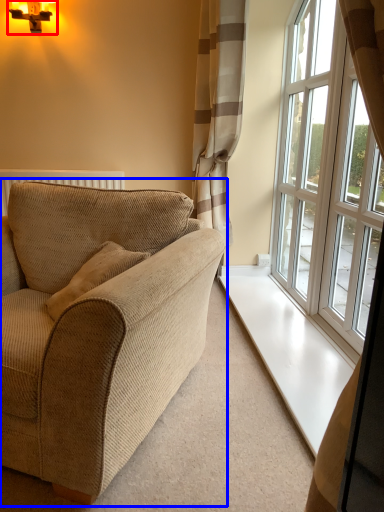
Question: Which point is closer to the camera, light fixture (highlighted by a red box) or studio couch (highlighted by a blue box)?

Choices:
 (A) light fixture
 (B) studio couch

Answer: (B)